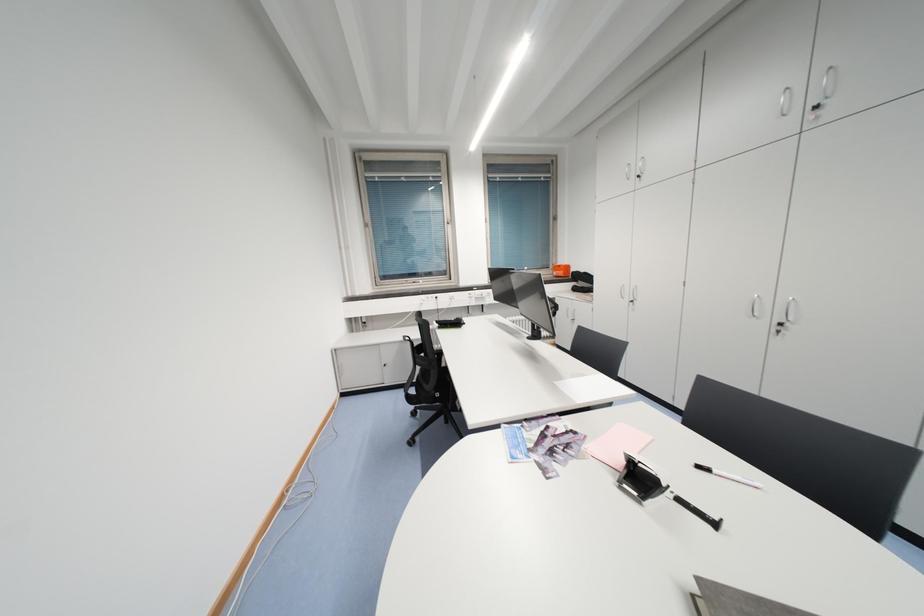
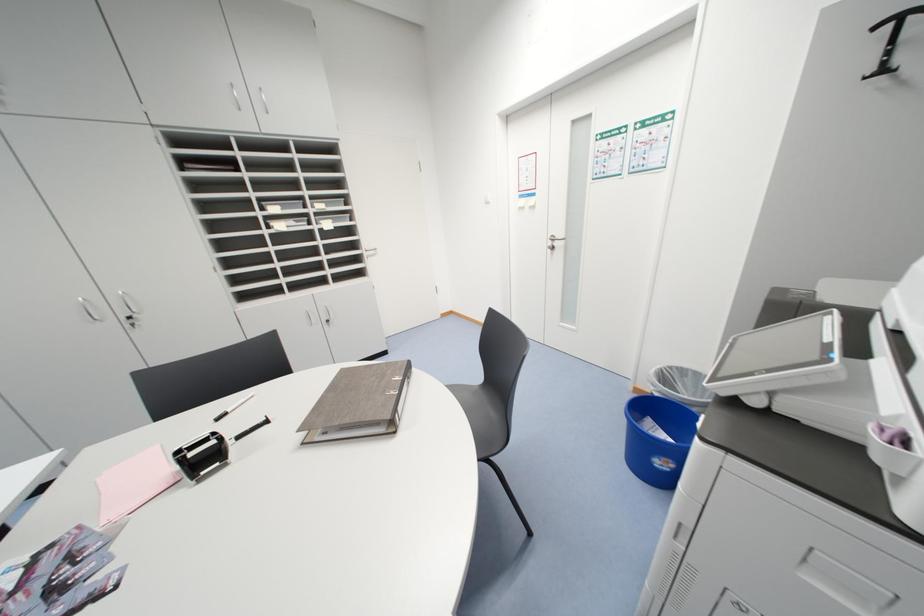
Consider the image. First-person continuous shooting, in which direction is the camera rotating?

The camera's rotation is toward right-down.